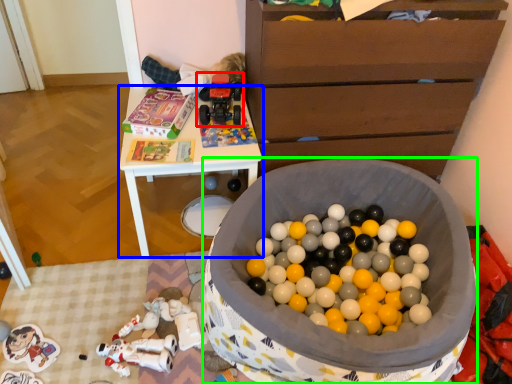
Question: Which object is positioned farthest from toy (highlighted by a red box)? Select from table (highlighted by a blue box) and toy (highlighted by a green box).

Choices:
 (A) table
 (B) toy

Answer: (B)